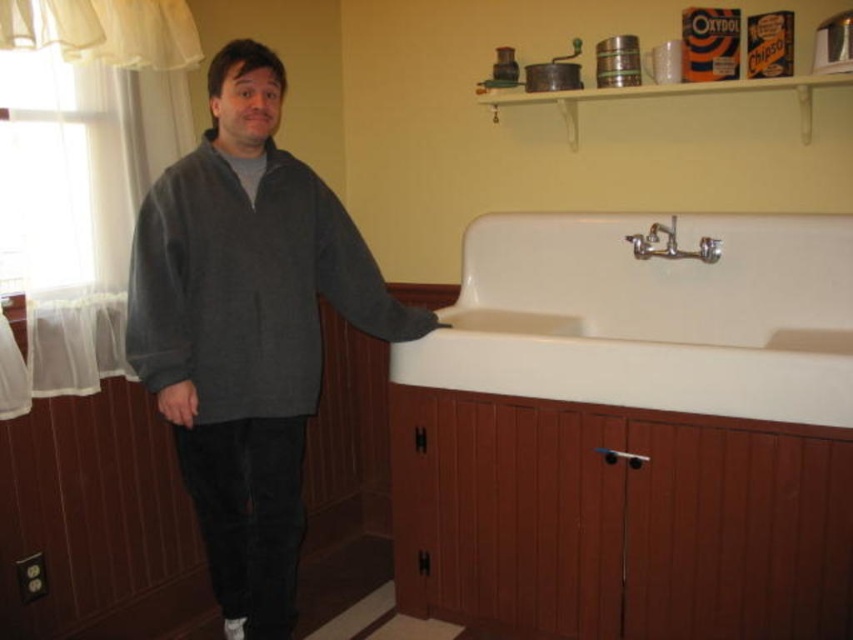
Does white porcelain sink at center appear under matte gray sweater at lower left?

No.

Which is below, white porcelain sink at center or matte gray sweater at lower left?

matte gray sweater at lower left is below.

Does point (703, 333) come farther from viewer compared to point (164, 410)?

Yes, point (703, 333) is behind point (164, 410).

The width and height of the screenshot is (853, 640). I want to click on white porcelain sink at center, so tap(650, 316).

Which is above, gray fleece jacket at center or matte gray sweater at lower left?

gray fleece jacket at center is above.

Consider the image. Which of these two, gray fleece jacket at center or matte gray sweater at lower left, stands shorter?

matte gray sweater at lower left

Does point (271, 621) come in front of point (157, 404)?

Yes, point (271, 621) is closer to viewer.

Find the location of a particular element. The width and height of the screenshot is (853, 640). gray fleece jacket at center is located at coordinates (248, 328).

Can you confirm if silver metallic faucet at upper center is thinner than matte gray sweater at lower left?

No.

Which is below, silver metallic faucet at upper center or matte gray sweater at lower left?

matte gray sweater at lower left

Describe the element at coordinates (671, 244) in the screenshot. The image size is (853, 640). I see `silver metallic faucet at upper center` at that location.

Identify the location of silver metallic faucet at upper center. (671, 244).